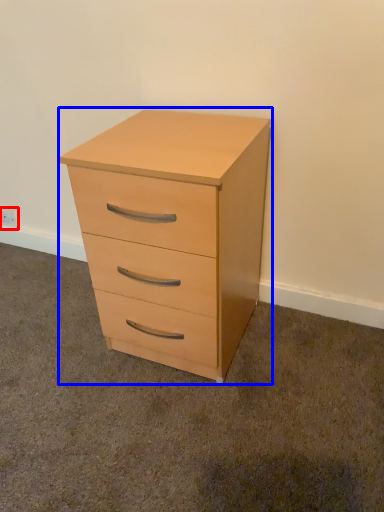
Question: Which object appears closest to the camera in this image, electric outlet (highlighted by a red box) or chest of drawers (highlighted by a blue box)?

Choices:
 (A) electric outlet
 (B) chest of drawers

Answer: (B)